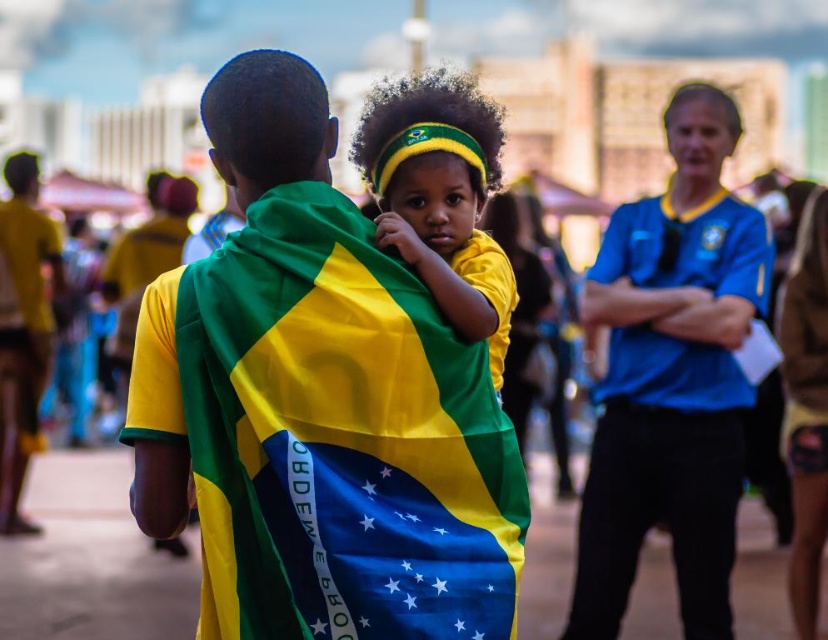
You are a photographer trying to capture a closeup of the matte yellow headband at center without the matte fabric boy at center blocking it. Is this possible given their sizes?

The matte fabric boy at center is taller than the matte yellow headband at center, so the boy would block the headband in the photo unless adjusted.

You are a photographer at the event and want to capture a closeup of the matte fabric boy at center and the matte yellow headband at center. Which object should you focus on first if you want to ensure both are in focus?

The matte fabric boy at center is below the matte yellow headband at center, so you should focus on the matte yellow headband at center first as it is closer to the camera.

You are standing in the crowd at this event and want to take a photo of both the man in the yellow and green shirt and the child in the yellow shirt. The man is at point (372, 273) and the child is at point (443, 150). If you want to ensure both are in focus, which point should you focus on first?

You should focus on point (372, 273) first because it is closer to the viewer than point (443, 150), so adjusting focus from near to far will help both be in focus.